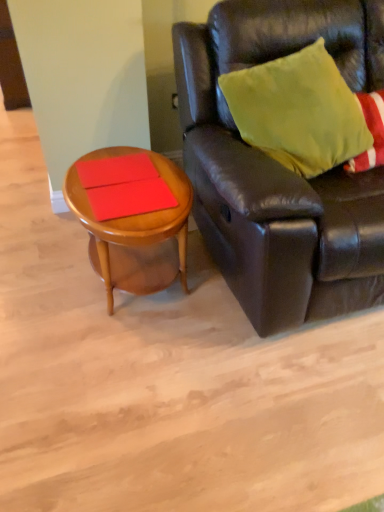
Where is `vacant area that is in front of matte red book at center, positioned as the second plank in top-to-bottom order`? This screenshot has width=384, height=512. vacant area that is in front of matte red book at center, positioned as the second plank in top-to-bottom order is located at coordinates (133, 222).